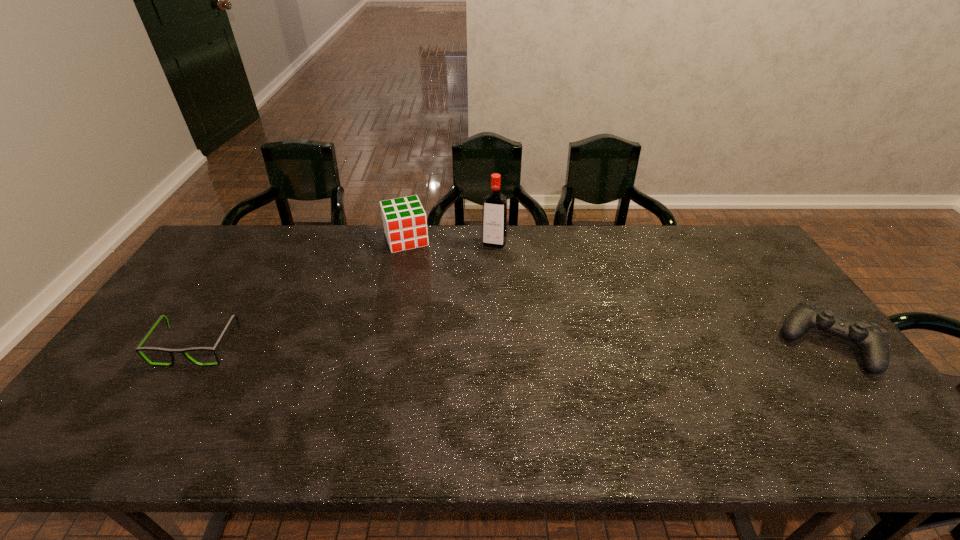
Locate an element on the screen. free spot located 0.180m on the front and back of the second object from right to left is located at coordinates [x=481, y=284].

At what (x,y) coordinates should I click in order to perform the action: click on vacant space situated on the front and back of the second object from right to left. Please return your answer as a coordinate pair (x, y). This screenshot has width=960, height=540. Looking at the image, I should click on (473, 310).

This screenshot has width=960, height=540. I want to click on vacant space situated on the front and back of the second object from right to left, so click(x=467, y=330).

The width and height of the screenshot is (960, 540). I want to click on free space located on the red face of the second object from left to right, so click(423, 284).

Identify the location of free space located on the red face of the second object from left to right. (444, 336).

The width and height of the screenshot is (960, 540). In order to click on free space located on the red face of the second object from left to right in this screenshot , I will do `click(420, 272)`.

This screenshot has width=960, height=540. I want to click on vodka at the far edge, so click(495, 204).

Where is `cube that is positioned at the far edge`? cube that is positioned at the far edge is located at coordinates (405, 225).

Identify the location of object at the left edge. This screenshot has height=540, width=960. [171, 351].

The height and width of the screenshot is (540, 960). I want to click on object that is at the right edge, so click(872, 339).